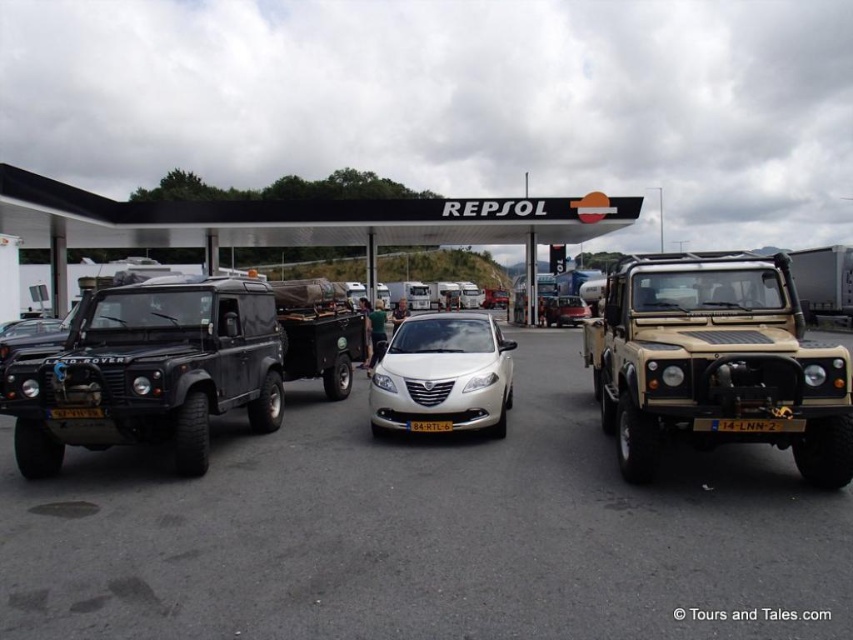
You are a delivery driver who needs to park your vehicle in the parking lot shown in the image. There is a matte black suv at left and a yellow matte license plate at center in the scene. Can you park your vehicle between these two objects without overlapping them?

The matte black suv at left is positioned over the yellow matte license plate at center, meaning there is no space between them for your vehicle to park without overlapping.